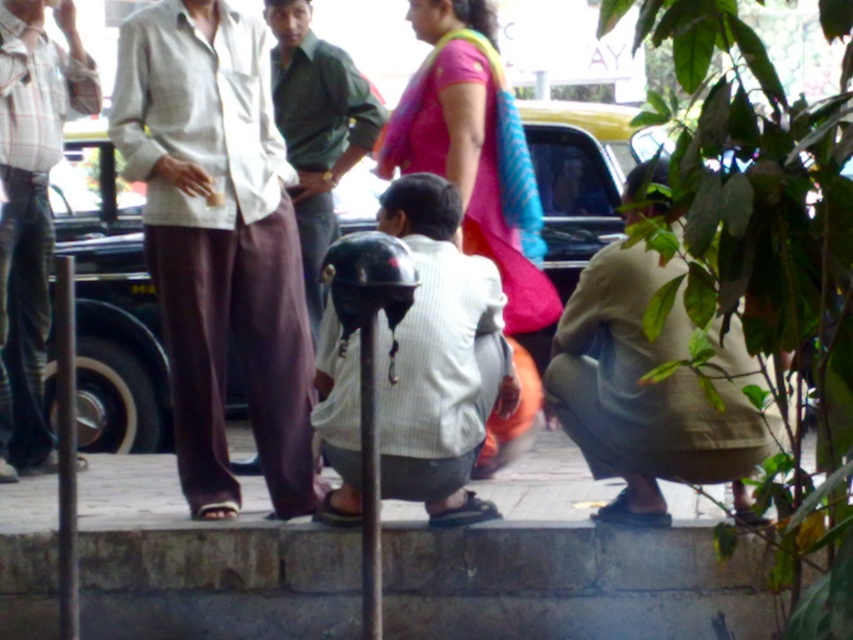
You are a delivery person trying to place a package that is 3 feet wide on the gray stone curb at lower center. Can the package fit on the curb if the plaid cotton shirt at left is currently occupying part of it?

The gray stone curb at lower center might be wider than plaid cotton shirt at left, so there could be enough space for the 3 feet wide package if the plaid cotton shirt at left is moved or if the package is placed in an unoccupied area of the curb.

You are a fashion designer observing the street scene. You notice two outfits in the image. Which outfit has a larger size between the pink fabric sari at center and the plaid cotton shirt at left?

The pink fabric sari at center has a larger size compared to the plaid cotton shirt at left.

You are a photographer trying to capture a detailed shot of the two points in the image. Which point, point (x=20, y=0) or point (x=294, y=204), would appear larger in your photo?

Point (x=20, y=0) is closer to the camera than point (x=294, y=204), so it would appear larger in the photo.